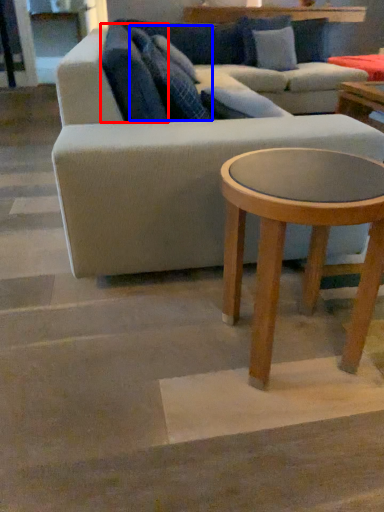
Question: Which object is further to the camera taking this photo, pillow (highlighted by a red box) or pillow (highlighted by a blue box)?

Choices:
 (A) pillow
 (B) pillow

Answer: (B)